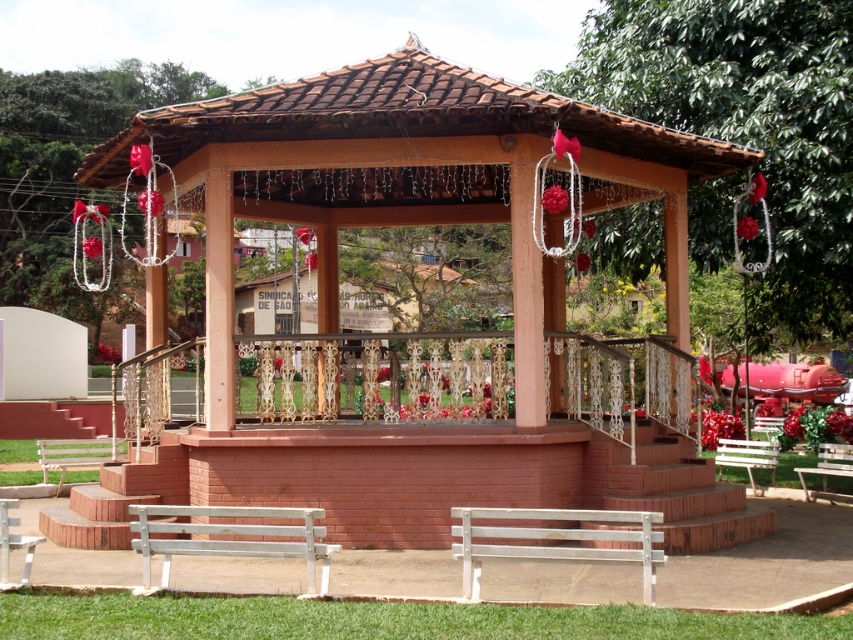
You are planning to place a large potted plant in the scene. The potted plant requires a space that can accommodate its size. Which object between the brown brick gazebo at center and the white wooden bench at lower center would be more suitable for placing the potted plant based on their sizes?

The brown brick gazebo at center is larger in size than the white wooden bench at lower center, so the potted plant would be more suitable to place near the brown brick gazebo at center as it offers a larger space.

You are planning to host a small gathering in the gazebo and need to seat 8 people. The white painted wood bench at lower center can seat 4 people. How many more people can the white wooden bench at center accommodate?

The white painted wood bench at lower center is larger in size than white wooden bench at center. Since the larger bench can seat 4 people, the smaller one likely seats fewer. Therefore, the white wooden bench at center can accommodate fewer than 4 people, so it cannot seat the remaining 4 needed for 8 total.

In the scene shown: You are a visitor at the park and want to sit on the benches. Which bench is located higher up, the white painted wood bench at lower center or the white wooden bench at center?

The white painted wood bench at lower center is above the white wooden bench at center, so it is located higher up.